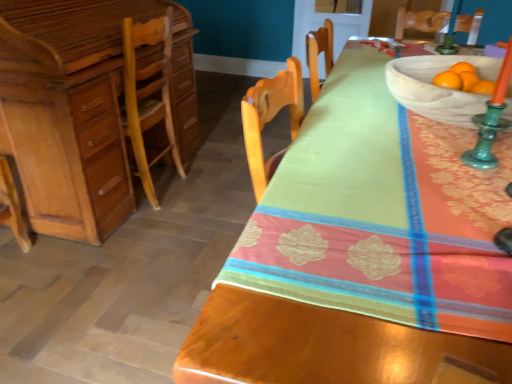
Question: From the image's perspective, is light brown wood desk at left on top of natural wood bowl at upper right?

Choices:
 (A) no
 (B) yes

Answer: (B)

Question: Can we say light brown wood desk at left lies outside natural wood bowl at upper right?

Choices:
 (A) no
 (B) yes

Answer: (B)

Question: Can you confirm if light brown wood desk at left is wider than natural wood bowl at upper right?

Choices:
 (A) no
 (B) yes

Answer: (B)

Question: From a real-world perspective, is light brown wood desk at left below natural wood bowl at upper right?

Choices:
 (A) yes
 (B) no

Answer: (A)

Question: Is light brown wood desk at left to the right of natural wood bowl at upper right from the viewer's perspective?

Choices:
 (A) no
 (B) yes

Answer: (A)

Question: From their relative heights in the image, would you say light brown wood desk at left is taller or shorter than matte wood desk at left?

Choices:
 (A) tall
 (B) short

Answer: (A)

Question: From the image's perspective, is light brown wood desk at left located above or below matte wood desk at left?

Choices:
 (A) above
 (B) below

Answer: (A)

Question: Considering the relative positions of light brown wood desk at left and matte wood desk at left in the image provided, is light brown wood desk at left to the left or to the right of matte wood desk at left?

Choices:
 (A) right
 (B) left

Answer: (B)

Question: In the image, is light brown wood desk at left positioned in front of or behind matte wood desk at left?

Choices:
 (A) front
 (B) behind

Answer: (B)

Question: Considering the positions of natural wood bowl at upper right and matte wood desk at left in the image, is natural wood bowl at upper right taller or shorter than matte wood desk at left?

Choices:
 (A) tall
 (B) short

Answer: (B)

Question: From the image's perspective, is natural wood bowl at upper right above or below matte wood desk at left?

Choices:
 (A) above
 (B) below

Answer: (A)

Question: Does point (507, 112) appear closer or farther from the camera than point (402, 291)?

Choices:
 (A) closer
 (B) farther

Answer: (B)

Question: Looking at the image, does natural wood bowl at upper right seem bigger or smaller compared to matte wood desk at left?

Choices:
 (A) big
 (B) small

Answer: (B)

Question: In the image, is light brown wood desk at left positioned in front of or behind natural wood bowl at upper right?

Choices:
 (A) behind
 (B) front

Answer: (A)

Question: Is point (31, 102) positioned closer to the camera than point (445, 92)?

Choices:
 (A) farther
 (B) closer

Answer: (A)